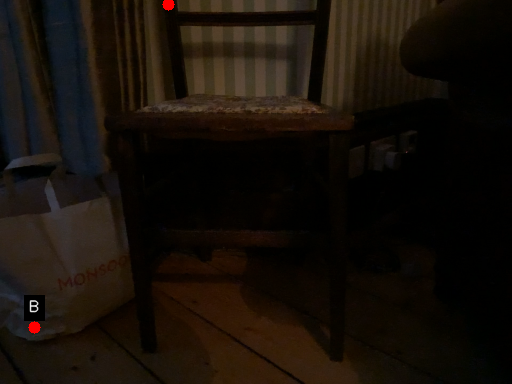
Question: Two points are circled on the image, labeled by A and B beside each circle. Which point is further to the camera?

Choices:
 (A) A is further
 (B) B is further

Answer: (A)